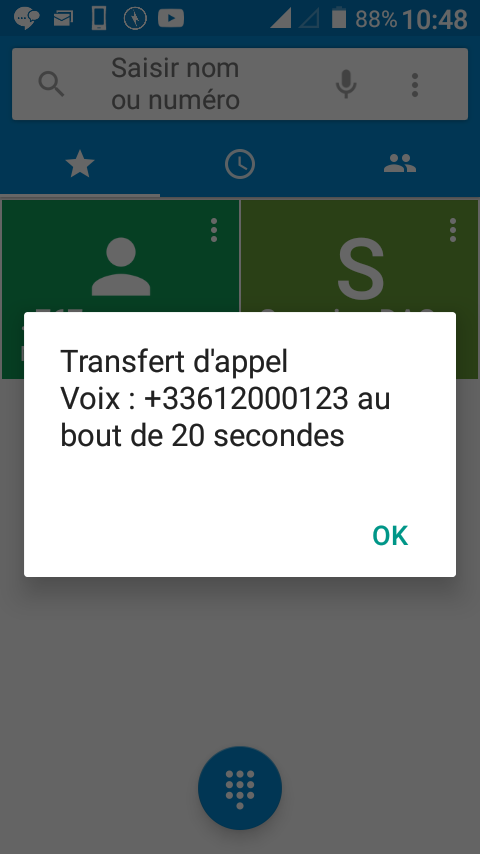
Where is `clock`? clock is located at coordinates (239, 164).